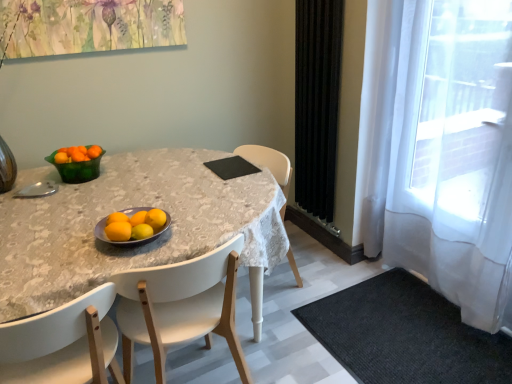
You are a GUI agent. You are given a task and a screenshot of the screen. Output one action in this format:
    pyautogui.click(x=<x>, y=<y>)
    Task: Click on the vacant space situated above matte gray bowl at center, arranged as the 1th bowl when ordered from the bottom (from a real-world perspective)
    
    Given the screenshot: What is the action you would take?
    pyautogui.click(x=135, y=224)